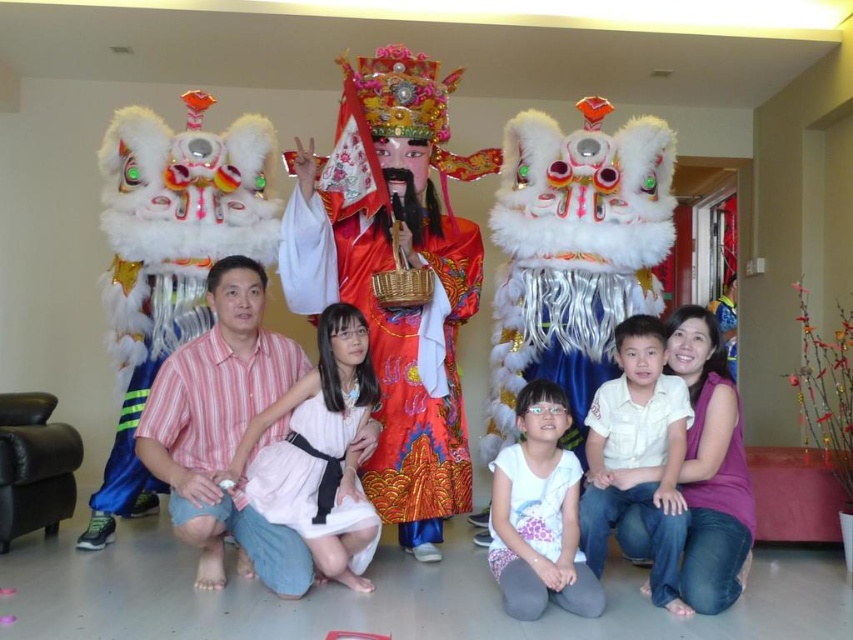
Who is higher up, silky red costume at center or white matte dress at center?

Positioned higher is silky red costume at center.

Does silky red costume at center have a lesser width compared to white matte dress at center?

Incorrect, silky red costume at center's width is not less than white matte dress at center's.

I want to click on silky red costume at center, so click(x=573, y=253).

Does silky red costume at center have a greater height compared to pink striped shirt at center?

Correct, silky red costume at center is much taller as pink striped shirt at center.

Does point (589, 342) come closer to viewer compared to point (276, 538)?

No.

From the picture: Who is more forward, (554, 269) or (277, 566)?

Point (277, 566) is in front.

Where is `silky red costume at center`? This screenshot has width=853, height=640. silky red costume at center is located at coordinates (573, 253).

Is silky red costume at center positioned in front of pink satin dress at center?

That is False.

Is point (593, 216) farther from camera compared to point (267, 461)?

Yes, it is.

Between point (590, 288) and point (263, 413), which one is positioned behind?

Point (590, 288)

This screenshot has width=853, height=640. Find the location of `silky red costume at center`. silky red costume at center is located at coordinates (573, 253).